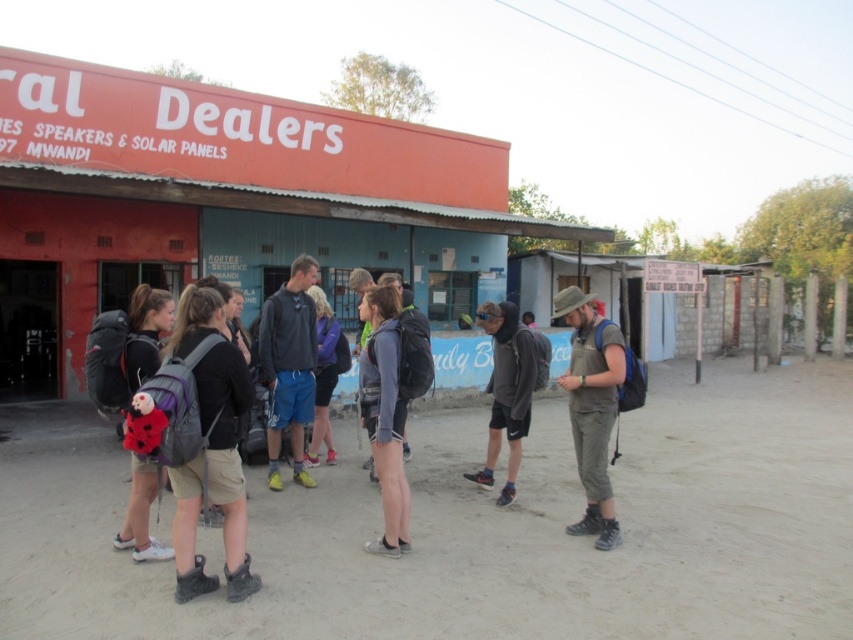
You are a photographer trying to capture a group photo of the travelers. You notice the matte khaki pants at center and the matte black backpack at left. Which item should you focus on to ensure it fits entirely within your camera frame if the frame can only accommodate the narrower object?

The matte khaki pants at center has a smaller width than the matte black backpack at left. Therefore, focus on the matte khaki pants at center to ensure it fits within the camera frame since it is narrower.

From the picture: You are standing in front of the Dealers building and need to locate two specific points on its wall. The first point is at coordinates point (300, 444) and the second is at point (489, 451). Which of these points is closer to you?

Point (300, 444) is closer to you because it is further to the viewer than point (489, 451).